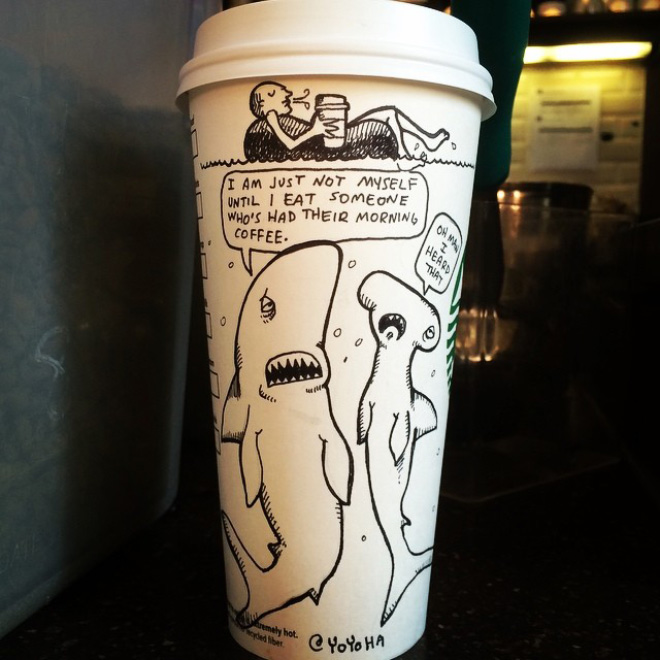
The width and height of the screenshot is (660, 660). Identify the location of light in background. (589, 57).